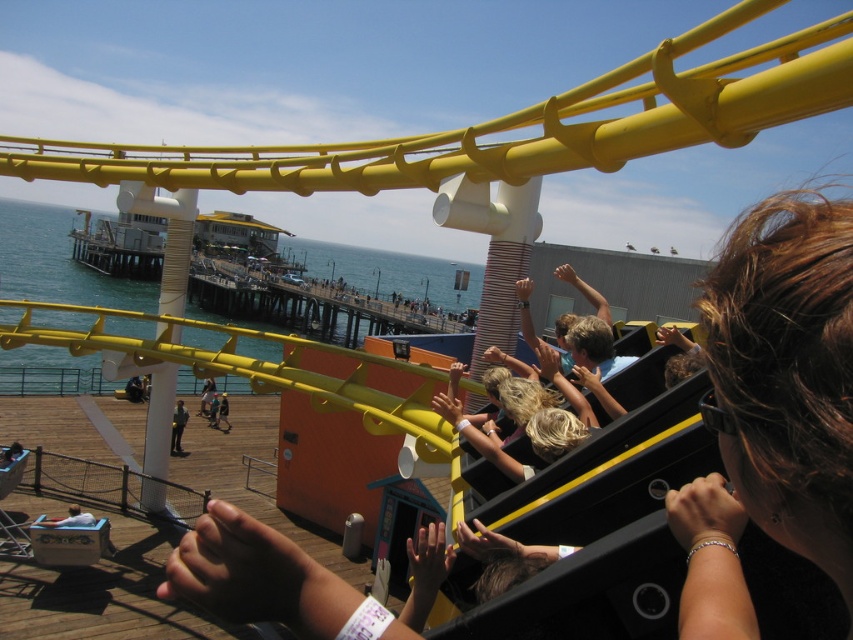
Is point (705, 324) positioned behind point (224, 397)?

No, it is not.

How much distance is there between dark brown hair at upper right and light brown leather jacket at center?

dark brown hair at upper right is 38.48 meters from light brown leather jacket at center.

Locate an element on the screen. This screenshot has height=640, width=853. dark brown hair at upper right is located at coordinates (773, 408).

Is the position of brown hair at upper right more distant than that of light brown hair at center?

No, brown hair at upper right is closer to the viewer.

Is brown hair at upper right below light brown hair at center?

No.

This screenshot has width=853, height=640. I want to click on brown hair at upper right, so click(x=772, y=406).

Can you confirm if dark brown hair at upper right is positioned above light blue shirt at lower left?

Correct, dark brown hair at upper right is located above light blue shirt at lower left.

Looking at this image, is dark brown hair at upper right positioned behind light blue shirt at lower left?

No, it is in front of light blue shirt at lower left.

Is point (680, 508) farther from viewer compared to point (82, 515)?

No, it is not.

Find the location of `dark brown hair at upper right`. dark brown hair at upper right is located at coordinates (773, 408).